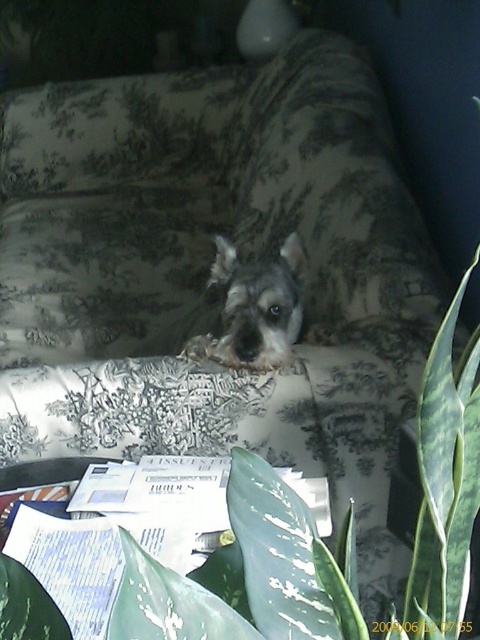
You are organizing a space for a new pet and need to ensure there is enough room for both the green leafy plant at center and the gray fur dog at center. Based on their sizes, which one requires more space?

The gray fur dog at center requires more space because the green leafy plant at center occupies less space than it.

You are a photographer trying to capture a closeup of the green leafy plant at center. You are currently positioned 14 inches away from it. Can you get a closer shot without moving the plant?

The green leafy plant at center is 13.94 inches from camera. Since you are already positioned 14 inches away, which is just slightly farther than the plant, you can move a tiny bit closer to achieve the desired closeup shot.

In the scene shown: You are standing in the room and want to place a new small statue exactly where the green leafy plant at center is currently located. Can you move the plant to make space? Please explain your reasoning.

The green leafy plant at center is located at coordinates [243,576], so yes, you can move it to another spot to make space for the new statue.